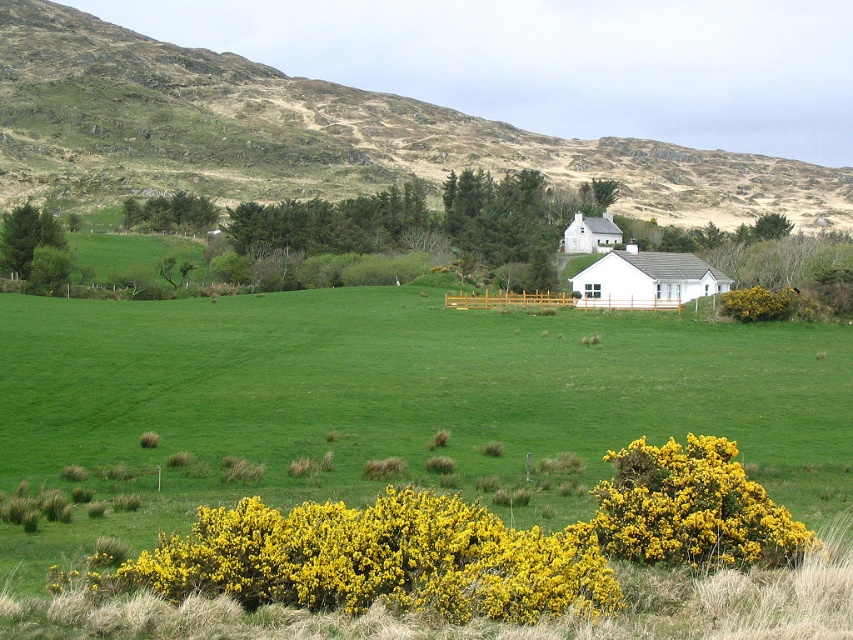
You are a hiker who wants to take a photo of both the green grassy hillside at upper center and the yellow fluffy bush at lower right in the same frame. Based on the scene description, do you think you can capture both in a single photo without moving your position? Explain your reasoning.

The green grassy hillside at upper center and the yellow fluffy bush at lower right are 267.06 meters apart. Since the distance between them is quite large, it might be challenging to capture both in a single photo without moving your position unless you have a wide angle lens or a zoom lens that can adjust the field of view to include both objects simultaneously.

You are planning to build a garden shed on the green grassy hillside at upper center or the white smooth house at center. Which location has more space for the shed?

The green grassy hillside at upper center has a larger size compared to the white smooth house at center, so it has more space for the garden shed.

Based on the photo, you are standing at the point labeled as point (317,134) in the image. Looking around, you see the small white house and the wooden fence. What is the immediate terrain you are standing on?

The point (317,134) corresponds to the green grassy hillside at upper center, so you are standing on green grassy hillside at upper center.